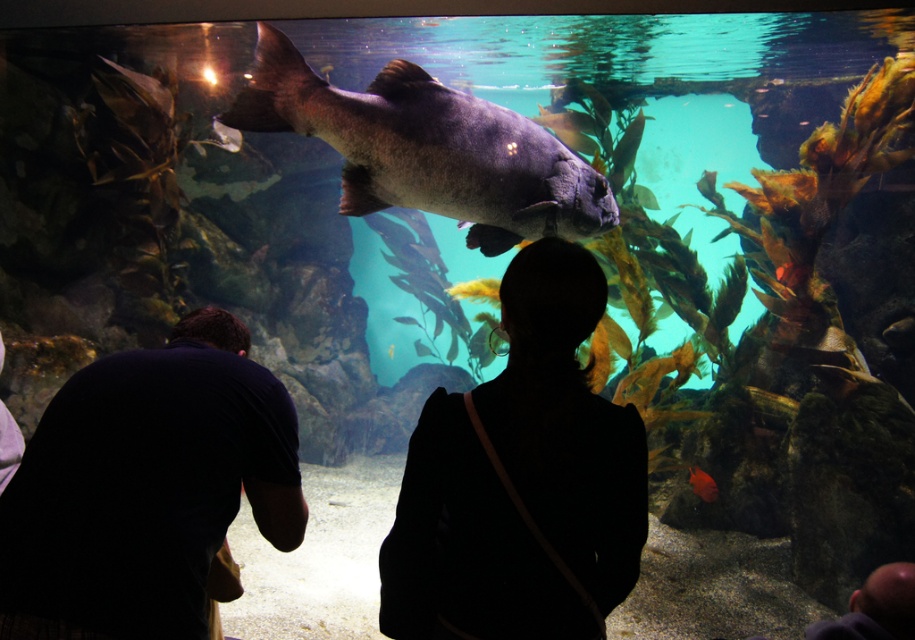
You are a visitor at the aquarium and want to take a photo of the large fish. You notice two objects in your way. Which object has a wider width between the dark blue shirt at lower left and the black fabric at center?

The dark blue shirt at lower left has a wider width than the black fabric at center.

You are standing in front of an aquarium and see a point marked at coordinate point (147, 490). Based on the scene description, what object or part of the scene is located at that coordinate?

The point (147, 490) is located on the dark blue shirt at lower left.

You are a visitor at the aquarium and notice the black fabric at center and the shiny silver fish at center. Which object is bigger in size?

The black fabric at center is larger in size compared to the shiny silver fish at center.